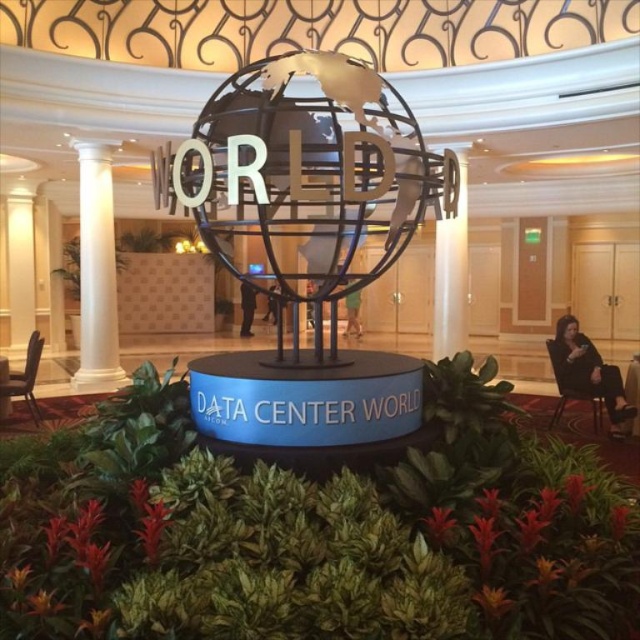
This screenshot has height=640, width=640. What do you see at coordinates (451, 275) in the screenshot? I see `white glossy pillar at center` at bounding box center [451, 275].

Is point (456, 246) positioned after point (593, 387)?

Yes, point (456, 246) is farther from viewer.

Where is `white glossy pillar at center`? This screenshot has height=640, width=640. white glossy pillar at center is located at coordinates (451, 275).

From the picture: Is metallic globe at center taller than white glossy pillar at center?

No, metallic globe at center is not taller than white glossy pillar at center.

Is metallic globe at center smaller than white glossy pillar at center?

Yes.

Does point (429, 177) come closer to viewer compared to point (451, 285)?

Yes, point (429, 177) is in front of point (451, 285).

Locate an element on the screen. The height and width of the screenshot is (640, 640). metallic globe at center is located at coordinates (305, 248).

Who is more distant from viewer, (113, 252) or (572, 387)?

Positioned behind is point (113, 252).

Is point (84, 308) positioned in front of point (579, 368)?

No, it is behind (579, 368).

At what (x,y) coordinates should I click in order to perform the action: click on white marble column at left. Please return your answer as a coordinate pair (x, y). The image size is (640, 640). Looking at the image, I should click on (97, 269).